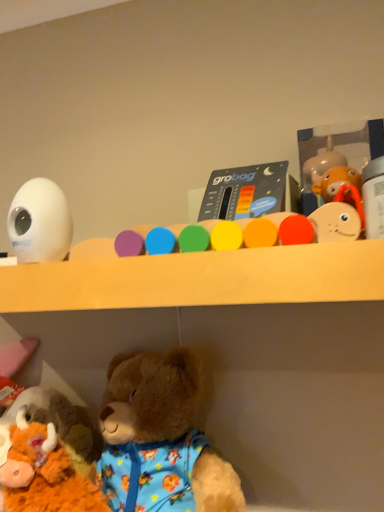
Question: Is white plastic bottle at upper right, positioned as the fourth toy in left-to-right order, to the left or to the right of matte plastic thermometer at center, placed as the 2th toy when sorted from right to left, in the image?

Choices:
 (A) left
 (B) right

Answer: (B)

Question: Would you say white plastic bottle at upper right, positioned as the fourth toy in left-to-right order, is inside or outside matte plastic thermometer at center, placed as the 4th toy when sorted from bottom to top?

Choices:
 (A) outside
 (B) inside

Answer: (A)

Question: Based on their relative distances, which object is nearer to the white plastic bottle at upper right, positioned as the fourth toy in left-to-right order?

Choices:
 (A) white glossy egg at upper left, the second toy positioned from the left
 (B) matte plastic thermometer at center, which appears as the 1th toy when viewed from the top
 (C) fluffy brown teddy bear at lower left, the fourth toy when ordered from right to left
 (D) fluffy brown teddy bear at lower left

Answer: (B)

Question: Based on their relative distances, which object is farther from the white plastic bottle at upper right, which is counted as the 3th toy, starting from the bottom?

Choices:
 (A) white glossy egg at upper left, the second toy positioned from the left
 (B) matte plastic thermometer at center, placed as the 4th toy when sorted from bottom to top
 (C) fluffy brown teddy bear at lower left
 (D) fluffy brown teddy bear at lower left, placed as the fourth toy when sorted from top to bottom

Answer: (D)